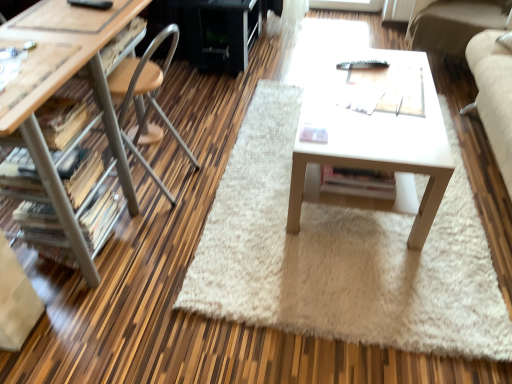
What is the approximate height of black glossy entertainment center at upper center?

It is 17.91 inches.

Where is `black glossy entertainment center at upper center`? The image size is (512, 384). black glossy entertainment center at upper center is located at coordinates (210, 30).

This screenshot has width=512, height=384. I want to click on suede-like beige couch at upper right, so click(454, 24).

This screenshot has height=384, width=512. What are the coordinates of `white matte table at center` in the screenshot? It's located at (372, 147).

In order to face white matte table at center, should I rotate leftwards or rightwards?

Rotate right and turn 13.992 degrees.

This screenshot has width=512, height=384. What do you see at coordinates (101, 118) in the screenshot?
I see `matte wood desk at left` at bounding box center [101, 118].

This screenshot has width=512, height=384. Find the location of `wooden drawer at left`. wooden drawer at left is located at coordinates (121, 41).

Measure the distance between point (438, 237) and camera.

They are 5.99 feet apart.

What do you see at coordinates (342, 255) in the screenshot? I see `white shaggy rug at center` at bounding box center [342, 255].

This screenshot has width=512, height=384. I want to click on black glossy entertainment center at upper center, so click(210, 30).

Considering the relative sizes of white shaggy rug at center and wooden drawer at left in the image provided, is white shaggy rug at center shorter than wooden drawer at left?

Yes, white shaggy rug at center is shorter than wooden drawer at left.

From a real-world perspective, is white shaggy rug at center positioned under wooden drawer at left based on gravity?

Yes, from a real-world perspective, white shaggy rug at center is under wooden drawer at left.

Is white shaggy rug at center at the left side of wooden drawer at left?

No.

Considering the relative positions of white shaggy rug at center and wooden drawer at left in the image provided, is white shaggy rug at center in front of wooden drawer at left?

Yes, the depth of white shaggy rug at center is less than that of wooden drawer at left.

From a real-world perspective, who is located lower, suede-like beige couch at upper right or wooden drawer at left?

suede-like beige couch at upper right is physically lower.

Is suede-like beige couch at upper right bigger or smaller than wooden drawer at left?

suede-like beige couch at upper right is bigger than wooden drawer at left.

Is suede-like beige couch at upper right aimed at wooden drawer at left?

Yes, suede-like beige couch at upper right is oriented towards wooden drawer at left.

From the image's perspective, is suede-like beige couch at upper right positioned above or below wooden drawer at left?

Clearly, from the image's perspective, suede-like beige couch at upper right is above wooden drawer at left.

In the scene shown: Which of these two, wooden drawer at left or matte wood desk at left, is bigger?

matte wood desk at left is bigger.

How far apart are wooden drawer at left and matte wood desk at left?

They are 23.90 centimeters apart.

Considering the relative positions of wooden drawer at left and matte wood desk at left in the image provided, is wooden drawer at left to the right of matte wood desk at left from the viewer's perspective?

Yes.

From the picture: From a real-world perspective, which object rests below the other?

matte wood desk at left.

Could you tell me if white matte table at center is turned towards wooden drawer at left?

No, white matte table at center does not turn towards wooden drawer at left.

From a real-world perspective, which object rests below the other?

Result: In real-world perspective, white matte table at center is lower.

Is white matte table at center positioned before wooden drawer at left?

Yes, it is.

Is point (315, 102) positioned behind point (134, 21)?

Yes, it is behind point (134, 21).

Which is more distant, (135, 18) or (231, 64)?

The point (231, 64) is behind.

Can you confirm if wooden drawer at left is smaller than black glossy entertainment center at upper center?

Yes.

Is wooden drawer at left in contact with black glossy entertainment center at upper center?

wooden drawer at left is not next to black glossy entertainment center at upper center, and they're not touching.

Is the position of white matte table at center more distant than that of suede-like beige couch at upper right?

No, the depth of white matte table at center is less than that of suede-like beige couch at upper right.

Is white matte table at center directly adjacent to suede-like beige couch at upper right?

No, white matte table at center is not with suede-like beige couch at upper right.

Is point (421, 64) less distant than point (488, 2)?

Yes, point (421, 64) is in front of point (488, 2).

From the picture: Is suede-like beige couch at upper right not within black glossy entertainment center at upper center?

Yes, suede-like beige couch at upper right is outside of black glossy entertainment center at upper center.

Based on the photo, between suede-like beige couch at upper right and black glossy entertainment center at upper center, which one has smaller width?

Thinner between the two is black glossy entertainment center at upper center.

Looking at this image, from a real-world perspective, does suede-like beige couch at upper right sit lower than black glossy entertainment center at upper center?

Incorrect, from a real-world perspective, suede-like beige couch at upper right is higher than black glossy entertainment center at upper center.

The width and height of the screenshot is (512, 384). In order to click on drawer located above the white shaggy rug at center (from a real-world perspective) in this screenshot , I will do `click(121, 41)`.

You are a GUI agent. You are given a task and a screenshot of the screen. Output one action in this format:
    pyautogui.click(x=<x>, y=<y>)
    Task: Click on the drawer in front of the suede-like beige couch at upper right
    The image size is (512, 384).
    Given the screenshot: What is the action you would take?
    pyautogui.click(x=121, y=41)

Looking at this image, considering their positions, is matte wood desk at left positioned closer to white matte table at center than suede-like beige couch at upper right?

matte wood desk at left.

Estimate the real-world distances between objects in this image. Which object is further from white matte table at center, suede-like beige couch at upper right or black glossy entertainment center at upper center?

black glossy entertainment center at upper center.

Considering their positions, is black glossy entertainment center at upper center positioned closer to matte wood desk at left than suede-like beige couch at upper right?

Based on the image, black glossy entertainment center at upper center appears to be nearer to matte wood desk at left.

Based on their spatial positions, is wooden drawer at left or suede-like beige couch at upper right closer to white shaggy rug at center?

Among the two, wooden drawer at left is located nearer to white shaggy rug at center.

From the picture: Looking at the image, which one is located closer to white matte table at center, suede-like beige couch at upper right or white shaggy rug at center?

Based on the image, white shaggy rug at center appears to be nearer to white matte table at center.

Estimate the real-world distances between objects in this image. Which object is closer to white shaggy rug at center, white matte table at center or suede-like beige couch at upper right?

white matte table at center lies closer to white shaggy rug at center than the other object.

From the image, which object appears to be nearer to white shaggy rug at center, matte wood desk at left or black glossy entertainment center at upper center?

matte wood desk at left lies closer to white shaggy rug at center than the other object.

Consider the image. Considering their positions, is matte wood desk at left positioned closer to white shaggy rug at center than wooden drawer at left?

matte wood desk at left.

Identify the location of drawer between matte wood desk at left and white shaggy rug at center. (121, 41).

Identify the location of mat between matte wood desk at left and black glossy entertainment center at upper center in the front-back direction. This screenshot has width=512, height=384. (342, 255).

Identify the location of table located between matte wood desk at left and suede-like beige couch at upper right in the left-right direction. pos(372,147).

What are the coordinates of `mat located between matte wood desk at left and white matte table at center in the left-right direction` in the screenshot? It's located at (342, 255).